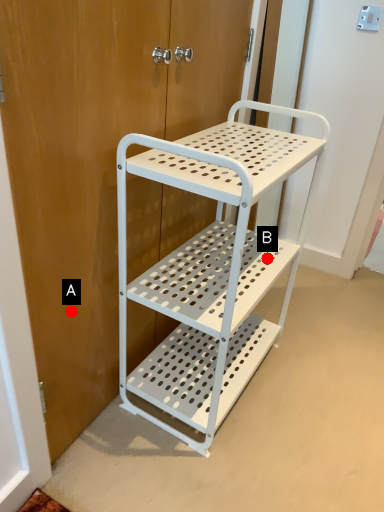
Question: Two points are circled on the image, labeled by A and B beside each circle. Which point is closer to the camera?

Choices:
 (A) A is closer
 (B) B is closer

Answer: (A)